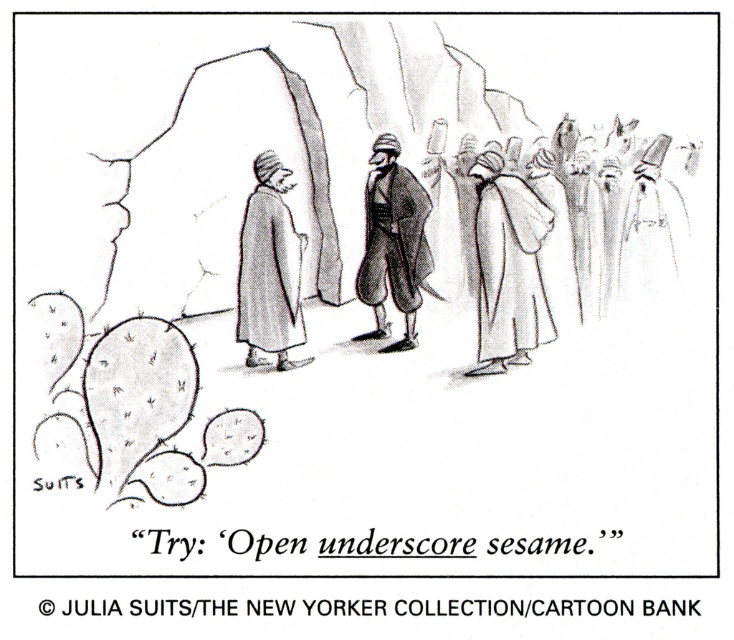
Based on the scene described, can the white cotton robe at center fit inside the smooth stone cave at center if the cave is narrower than the robe?

The smooth stone cave at center is narrower than the white cotton robe at center, so the robe cannot fit inside the cave.

You are an anthropologist studying Middle Eastern attire. In the cartoon, you notice two robes at the center of the scene. Which robe is closer to you, the matte brown robe at center or the smooth white robe at center?

The matte brown robe at center is closer to you because the smooth white robe at center is positioned behind it.

Based on the scene described, which object is located higher up in the image? The smooth stone cave at center or the white cotton robe at center?

The smooth stone cave at center is positioned over the white cotton robe at center, so it is higher up in the image.